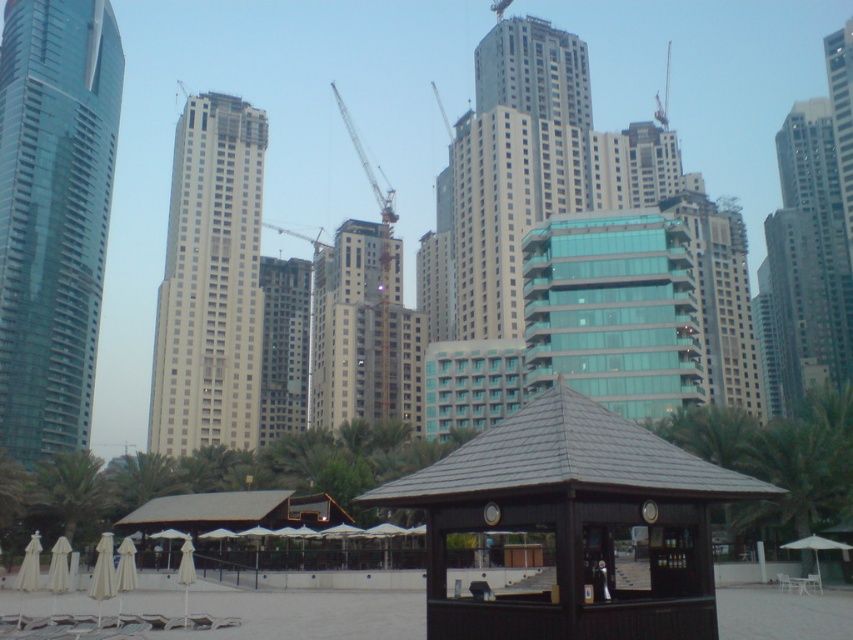
Question: Which point is farther from the camera taking this photo?

Choices:
 (A) (67, 531)
 (B) (505, 515)

Answer: (A)

Question: Which object is positioned closest to the white glass building at center?

Choices:
 (A) shiny glass skyscraper at left
 (B) green leafy palm tree at center
 (C) metallic gray crane at center
 (D) dark brown wooden gazebo at center

Answer: (A)

Question: Is gray concrete building at center further to the viewer compared to green leafy palm tree at lower left?

Choices:
 (A) yes
 (B) no

Answer: (A)

Question: Which object is the farthest from the dark brown wooden gazebo at center?

Choices:
 (A) green leafy palm tree at lower left
 (B) white glass building at center
 (C) metallic construction crane at center

Answer: (C)

Question: Can you confirm if gray concrete building at center is smaller than metallic gray crane at center?

Choices:
 (A) yes
 (B) no

Answer: (B)

Question: Is gray concrete building at center below metallic construction crane at center?

Choices:
 (A) yes
 (B) no

Answer: (A)